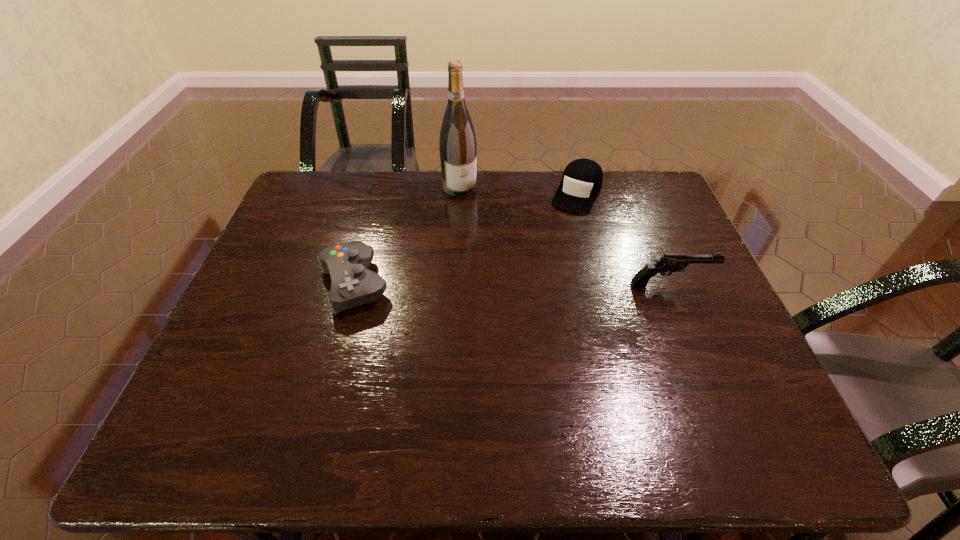
In order to click on the leftmost object in this screenshot , I will do `click(352, 285)`.

The width and height of the screenshot is (960, 540). I want to click on gun, so click(x=668, y=263).

Where is `the second object from left to right`? the second object from left to right is located at coordinates 458,148.

At what (x,y) coordinates should I click in order to perform the action: click on the tallest object. Please return your answer as a coordinate pair (x, y). The width and height of the screenshot is (960, 540). Looking at the image, I should click on (458, 148).

The image size is (960, 540). I want to click on cap, so click(x=582, y=179).

Locate an element on the screen. free space located on the left of the leftmost object is located at coordinates (271, 284).

The height and width of the screenshot is (540, 960). I want to click on blank area located 0.270m on the label of the tallest object, so click(497, 252).

This screenshot has width=960, height=540. I want to click on free region located 0.330m on the label of the tallest object, so click(x=506, y=266).

In order to click on vacant region located 0.190m on the label of the tallest object in this screenshot , I will do `click(487, 234)`.

Where is `free region located on the front-facing side of the cap`? free region located on the front-facing side of the cap is located at coordinates (539, 273).